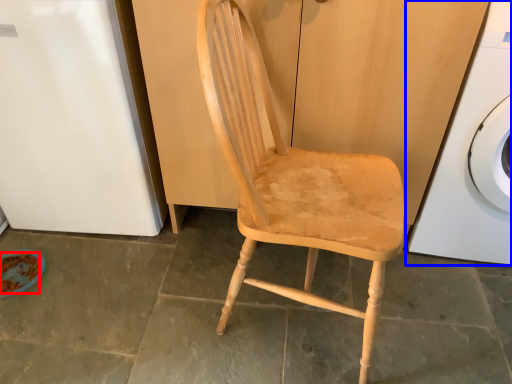
Question: Which object is closer to the camera taking this photo, food (highlighted by a red box) or washing machine (highlighted by a blue box)?

Choices:
 (A) food
 (B) washing machine

Answer: (B)